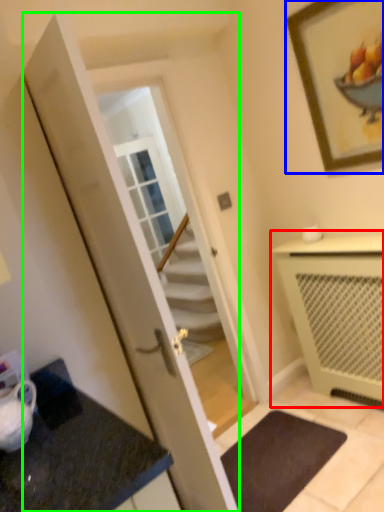
Question: Based on their relative distances, which object is farther from cabinetry (highlighted by a red box)? Choose from picture frame (highlighted by a blue box) and door (highlighted by a green box).

Choices:
 (A) picture frame
 (B) door

Answer: (B)